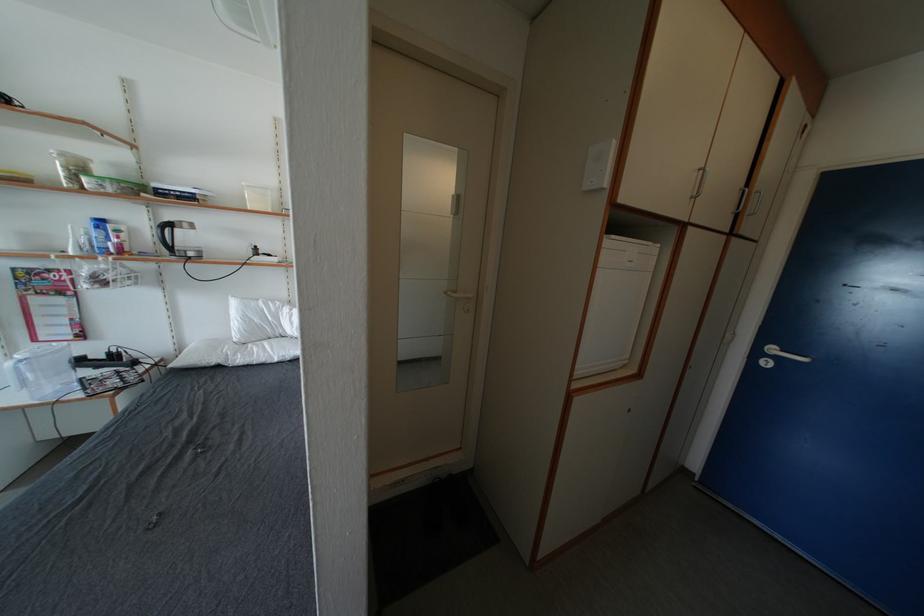
What do you see at coordinates (114, 354) in the screenshot?
I see `a black power plug` at bounding box center [114, 354].